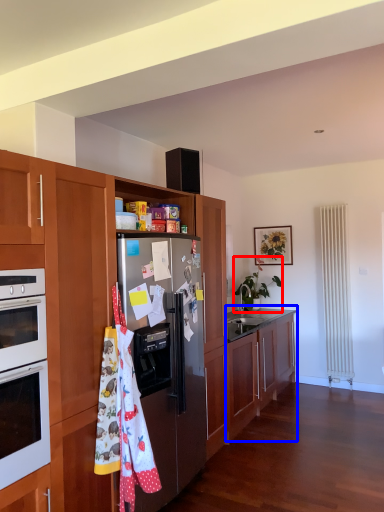
Question: Which of the following is the farthest to the observer, houseplant (highlighted by a red box) or cabinetry (highlighted by a blue box)?

Choices:
 (A) houseplant
 (B) cabinetry

Answer: (A)